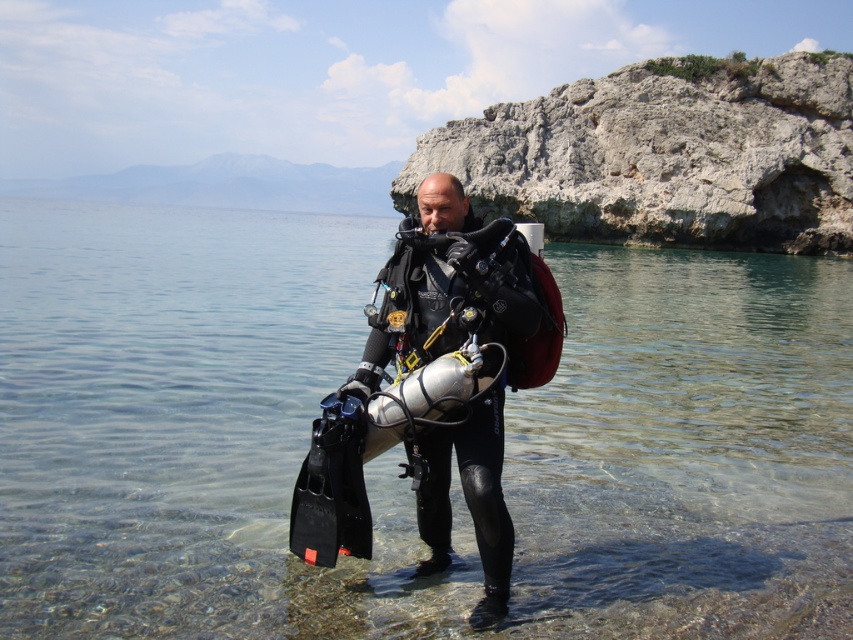
Who is shorter, clear water at center or black matte wetsuit at center?

With less height is black matte wetsuit at center.

Does point (772, 449) lie in front of point (364, 378)?

No, (772, 449) is further to viewer.

Locate an element on the screen. clear water at center is located at coordinates (190, 428).